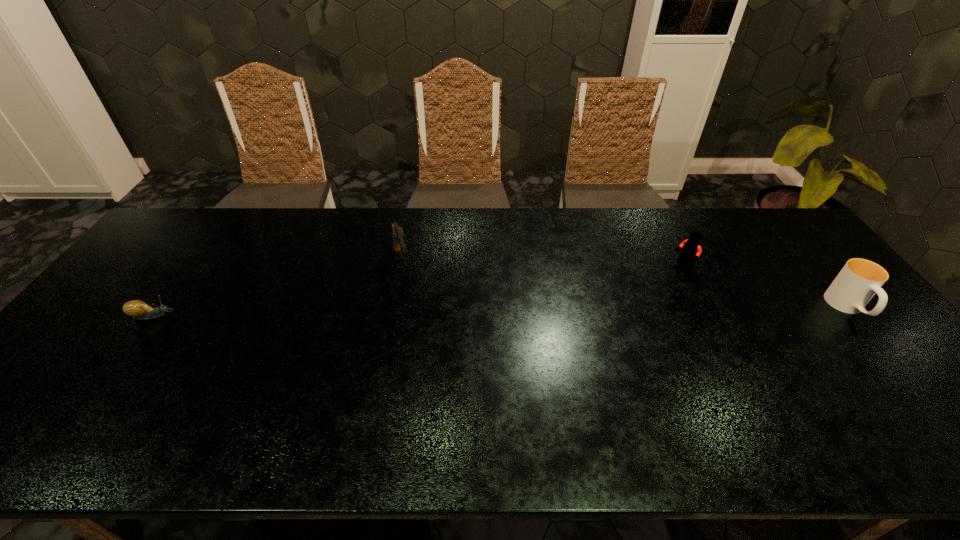
I want to click on escargot, so click(138, 309).

You are a GUI agent. You are given a task and a screenshot of the screen. Output one action in this format:
    pyautogui.click(x=<x>, y=<y>)
    Task: Click on the leftmost object
    
    Given the screenshot: What is the action you would take?
    [x=138, y=309]

This screenshot has width=960, height=540. What are the coordinates of `the rightmost object` in the screenshot? It's located at (859, 280).

Locate an element on the screen. The width and height of the screenshot is (960, 540). Lego is located at coordinates (691, 249).

At what (x,y) coordinates should I click in order to perform the action: click on the second object from left to right. Please return your answer as a coordinate pair (x, y). Image resolution: width=960 pixels, height=540 pixels. Looking at the image, I should click on (399, 237).

At what (x,y) coordinates should I click in order to perform the action: click on vacant space located on the front-facing side of the escargot. Please return your answer as a coordinate pair (x, y). The width and height of the screenshot is (960, 540). Looking at the image, I should click on (198, 316).

At what (x,y) coordinates should I click in order to perform the action: click on free space located 0.070m with the handle on the side of the cup. Please return your answer as a coordinate pair (x, y). Looking at the image, I should click on (882, 349).

You are a GUI agent. You are given a task and a screenshot of the screen. Output one action in this format:
    pyautogui.click(x=<x>, y=<y>)
    Task: Click on the vacant region located on the front-facing side of the Lego
    
    Given the screenshot: What is the action you would take?
    pyautogui.click(x=612, y=308)

The image size is (960, 540). In order to click on vacant region located on the front-facing side of the Lego in this screenshot , I will do `click(586, 323)`.

Find the location of a particular element. free point located on the front-facing side of the Lego is located at coordinates (660, 280).